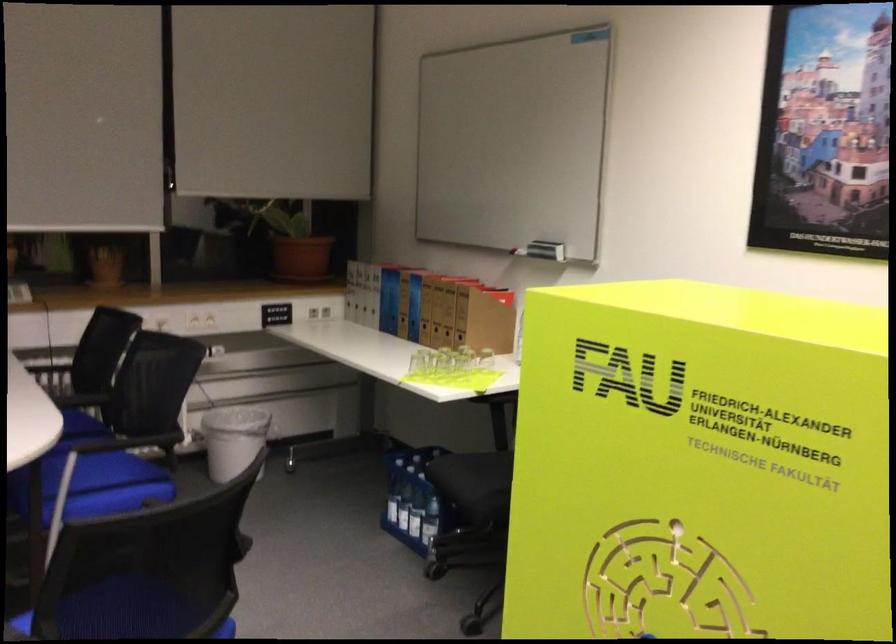
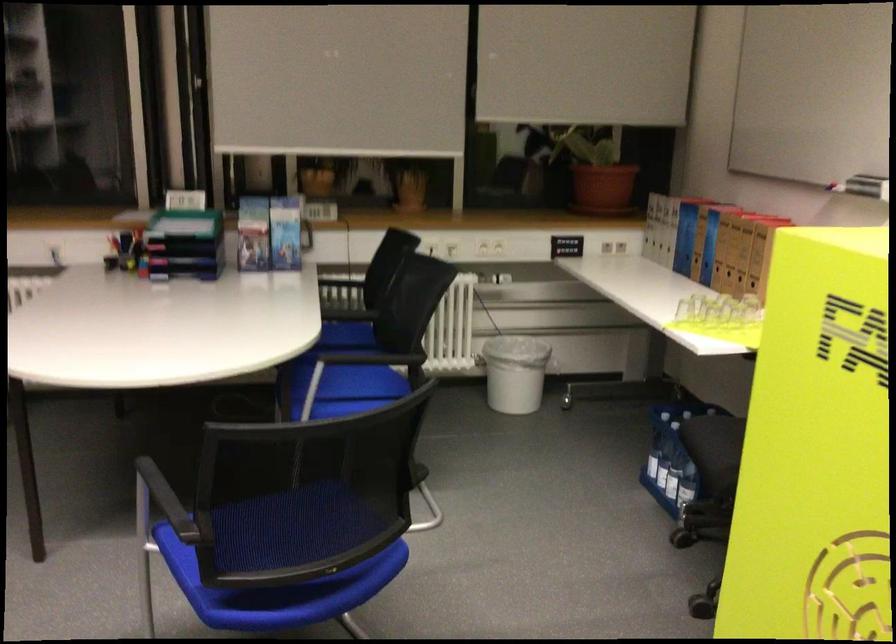
Where in the second image is the point corresponding to pixel 392 506 from the first image?

(650, 458)